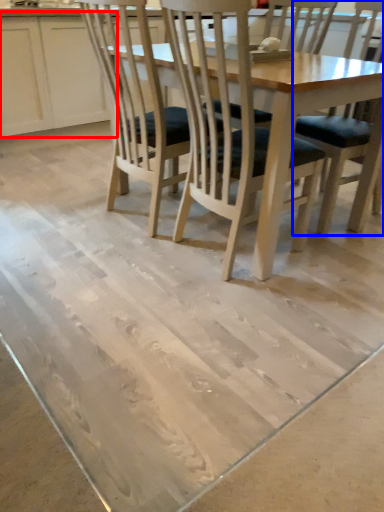
Question: Among these objects, which one is nearest to the camera, cabinetry (highlighted by a red box) or chair (highlighted by a blue box)?

Choices:
 (A) cabinetry
 (B) chair

Answer: (B)